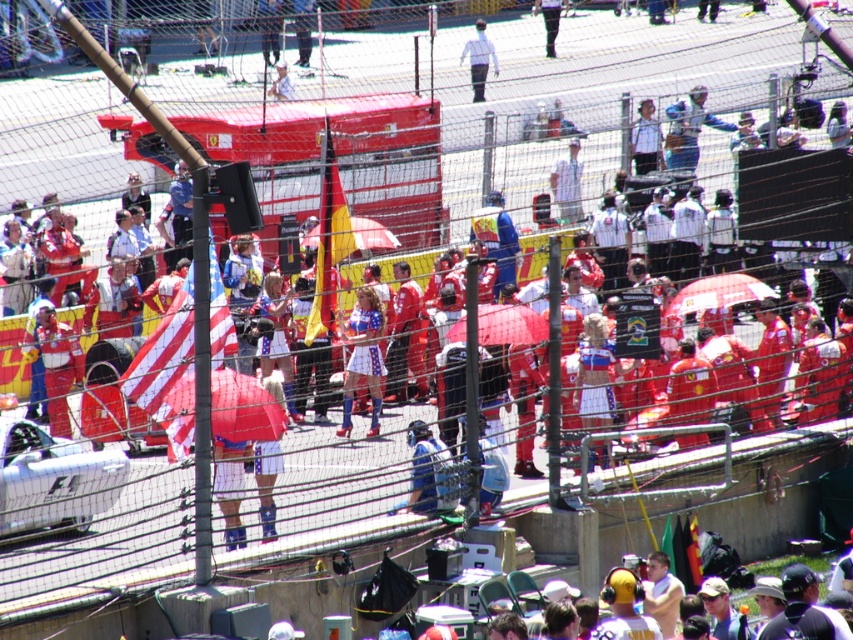
Which is in front, point (268, 157) or point (460, 54)?

Positioned in front is point (268, 157).

Who is shorter, red matte bus at center or white matte shirt at center?

With less height is white matte shirt at center.

At what (x,y) coordinates should I click in order to perform the action: click on red matte bus at center. Please return your answer as a coordinate pair (x, y). This screenshot has height=640, width=853. Looking at the image, I should click on (337, 161).

Who is positioned more to the left, red matte bus at center or matte red dress at center?

From the viewer's perspective, red matte bus at center appears more on the left side.

Measure the distance from red matte bus at center to matte red dress at center.

They are 36.78 feet apart.

The image size is (853, 640). What do you see at coordinates (337, 161) in the screenshot? I see `red matte bus at center` at bounding box center [337, 161].

The height and width of the screenshot is (640, 853). In order to click on red matte bus at center in this screenshot , I will do `click(337, 161)`.

This screenshot has height=640, width=853. Describe the element at coordinates (57, 365) in the screenshot. I see `red fabric umbrella at center` at that location.

Who is lower down, red fabric umbrella at center or white fabric umbrella at center?

red fabric umbrella at center is lower down.

What do you see at coordinates (57, 365) in the screenshot?
I see `red fabric umbrella at center` at bounding box center [57, 365].

Locate an element on the screen. This screenshot has width=853, height=640. red fabric umbrella at center is located at coordinates (x=57, y=365).